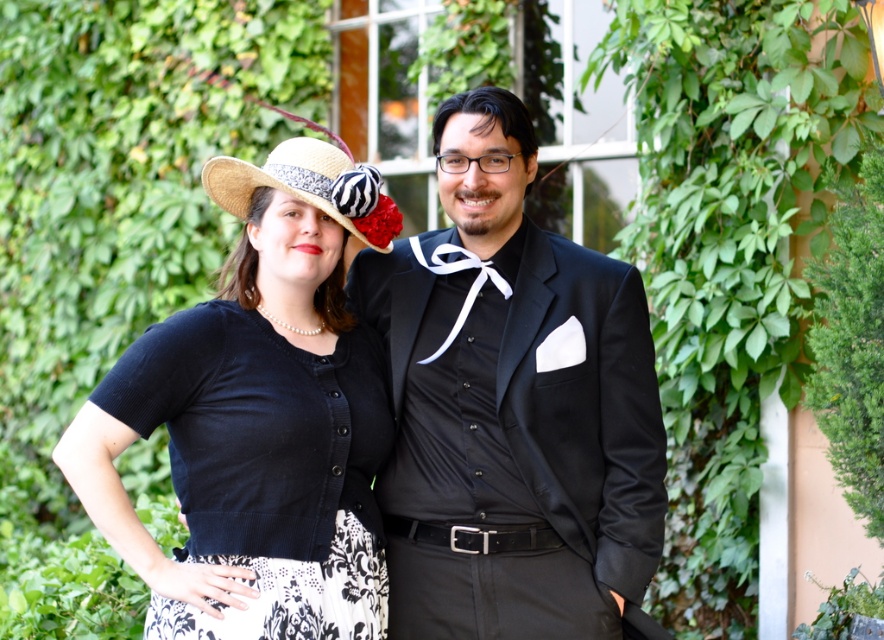
You are a photographer trying to capture a closeup of the matte black cardigan at center and the straw hat at center. Which object should you focus on first to ensure it appears sharp in the photo?

The matte black cardigan at center is closer to the viewer than the straw hat at center, so you should focus on the matte black cardigan at center first to ensure it appears sharp.

You are an interior designer who needs to place a new sofa in a living room. The sofa must be positioned exactly at the coordinates given for the matte black cardigan at center. What are the coordinates where you should place the sofa?

The coordinates for the matte black cardigan at center are at point (258, 419), so you should place the sofa at those coordinates.